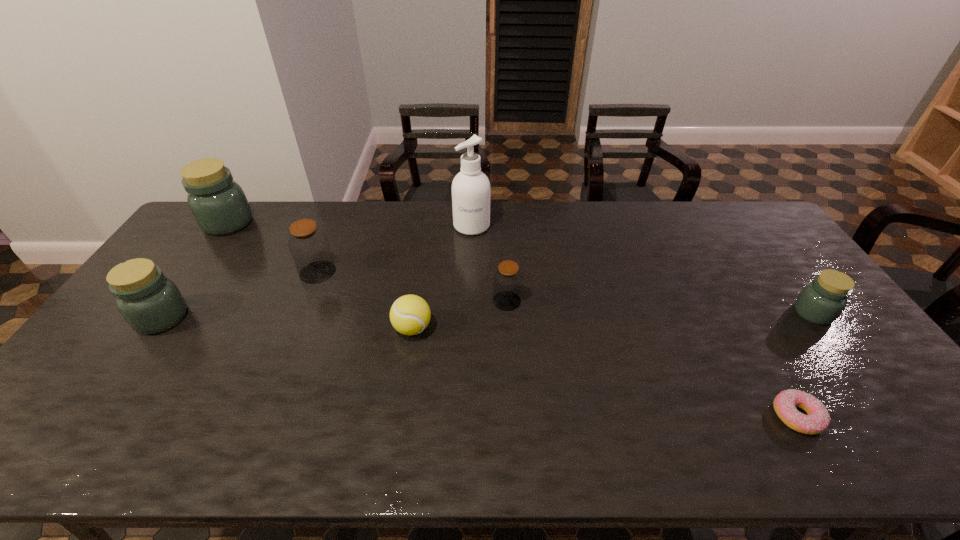
This screenshot has width=960, height=540. In order to click on the rightmost green jar in this screenshot , I will do `click(821, 302)`.

This screenshot has width=960, height=540. In order to click on the fifth object from right to left in this screenshot , I will do `click(410, 314)`.

This screenshot has height=540, width=960. I want to click on the seventh tallest object, so click(x=410, y=314).

Locate an element on the screen. This screenshot has width=960, height=540. pink doughnut is located at coordinates (817, 419).

Image resolution: width=960 pixels, height=540 pixels. I want to click on the seventh object from left to right, so click(x=817, y=419).

Where is `vacant space located 0.300m on the front label of the cleansing agent`? This screenshot has height=540, width=960. vacant space located 0.300m on the front label of the cleansing agent is located at coordinates (470, 299).

Where is `free space located 0.360m on the front of the biggest green jar`? This screenshot has height=540, width=960. free space located 0.360m on the front of the biggest green jar is located at coordinates (163, 315).

You are a GUI agent. You are given a task and a screenshot of the screen. Output one action in this format:
    pyautogui.click(x=<x>, y=<y>)
    Task: Click on the free space located 0.210m on the back of the third jar from right to left
    
    Given the screenshot: What is the action you would take?
    pyautogui.click(x=338, y=222)

Locate an element on the screen. The image size is (960, 540). free location located on the right of the second smallest green jar is located at coordinates (264, 318).

Image resolution: width=960 pixels, height=540 pixels. I want to click on free region located on the front of the third object from right to left, so click(516, 443).